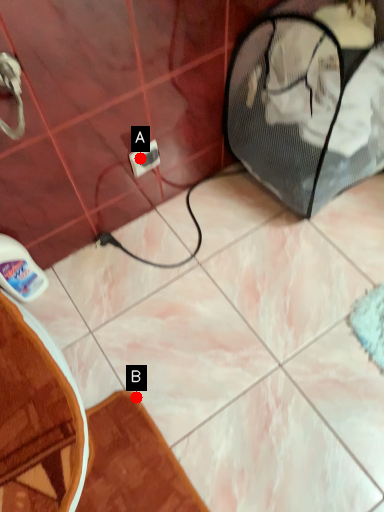
Question: Two points are circled on the image, labeled by A and B beside each circle. Which of the following is the closest to the observer?

Choices:
 (A) A is closer
 (B) B is closer

Answer: (B)